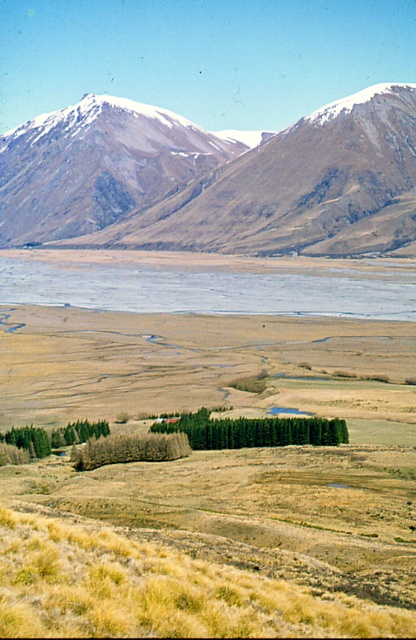
You are a hiker trying to cross the dry grassland at center to reach the snowy rocky mountain range at upper center. Based on the scene description, which of these two landmarks is closer to your current position?

The dry grassland at center is closer to your current position because it is shorter in height compared to the snowy rocky mountain range at upper center, indicating proximity.

You are an outdoor enthusiast planning a hiking trip and want to know which object in the scene is bigger. You see the snowy rocky mountain range at upper center and the blue water at center. Which one is larger in size?

The snowy rocky mountain range at upper center is larger in size than the blue water at center according to the description provided.